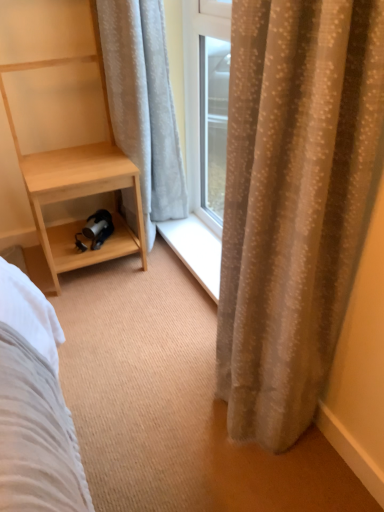
The width and height of the screenshot is (384, 512). I want to click on free space in front of light wood/texture shelf at left, so click(101, 310).